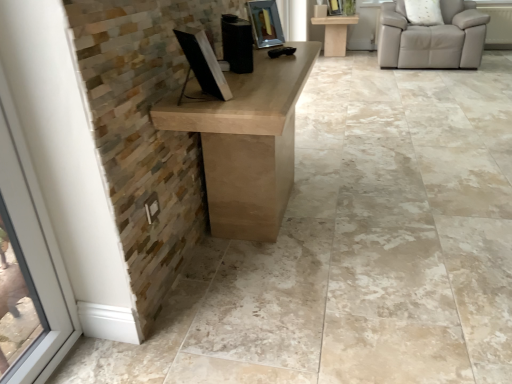
Question: Is matte beige table at upper center taller or shorter than beige leather chair at upper right?

Choices:
 (A) tall
 (B) short

Answer: (A)

Question: From the image's perspective, is matte beige table at upper center positioned above or below beige leather chair at upper right?

Choices:
 (A) below
 (B) above

Answer: (A)

Question: Estimate the real-world distances between objects in this image. Which object is farther from the metallic reflective picture frame at upper center, positioned as the 1th picture frame in left-to-right order?

Choices:
 (A) matte silver picture frame at upper center, marked as the first picture frame in a top-to-bottom arrangement
 (B) matte beige table at upper center
 (C) black matte speaker at center
 (D) white fabric pillow at upper right
 (E) beige leather chair at upper right

Answer: (A)

Question: Which object is the farthest from the metallic reflective picture frame at upper center, which is counted as the 1th picture frame, starting from the front?

Choices:
 (A) black matte speaker at center
 (B) white fabric pillow at upper right
 (C) matte beige table at upper center
 (D) matte silver picture frame at upper center, the 2th picture frame viewed from the left
 (E) beige leather chair at upper right

Answer: (D)